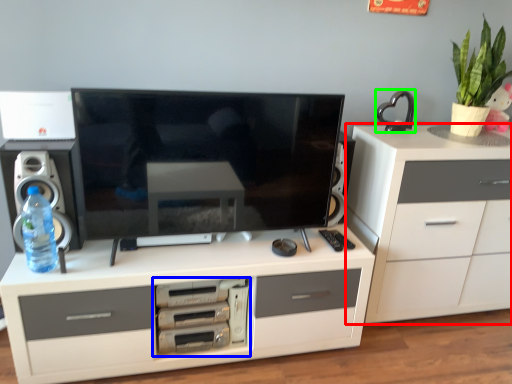
Question: Considering the real-world distances, which object is closest to chest of drawers (highlighted by a red box)? home appliance (highlighted by a blue box) or appliance (highlighted by a green box).

Choices:
 (A) home appliance
 (B) appliance

Answer: (B)